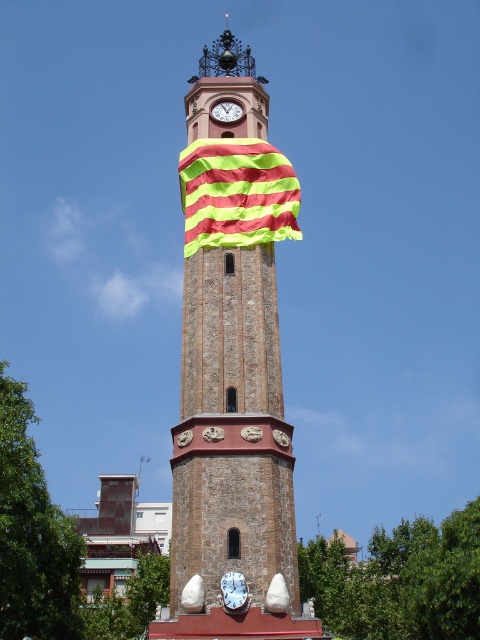
You are standing in front of the clock tower and see a point marked at coordinates (x=237, y=193). What object does this point correspond to?

The point at coordinates (x=237, y=193) corresponds to the yellow green striped cloth at center.

You are standing in front of the clock tower and want to know where the white glossy clock at center is positioned relative to the tower. Can you describe its location using the coordinates provided?

The white glossy clock at center is located at point coordinates 0.923 on the x axis and 0.487 on the y axis.